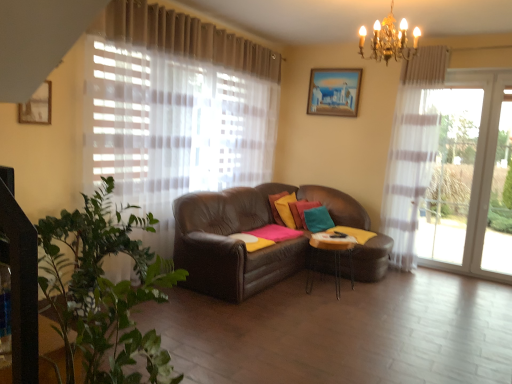
Question: Considering the relative sizes of wooden picture frame at upper left, the 2th picture frame viewed from the top, and wooden painted picture frame at upper center, which is the 2th picture frame from bottom to top, in the image provided, is wooden picture frame at upper left, the 2th picture frame viewed from the top, wider than wooden painted picture frame at upper center, which is the 2th picture frame from bottom to top,?

Choices:
 (A) yes
 (B) no

Answer: (B)

Question: Is wooden picture frame at upper left, the first picture frame viewed from the front, smaller than wooden painted picture frame at upper center, marked as the 2th picture frame in a front-to-back arrangement?

Choices:
 (A) yes
 (B) no

Answer: (A)

Question: From a real-world perspective, is wooden picture frame at upper left, which is the second picture frame from right to left, located higher than wooden painted picture frame at upper center, the 1th picture frame viewed from the back?

Choices:
 (A) yes
 (B) no

Answer: (B)

Question: Is wooden picture frame at upper left, the 2th picture frame viewed from the top, oriented away from wooden painted picture frame at upper center, marked as the 2th picture frame in a front-to-back arrangement?

Choices:
 (A) yes
 (B) no

Answer: (B)

Question: Is wooden picture frame at upper left, the 2th picture frame viewed from the top, thinner than wooden painted picture frame at upper center, the first picture frame viewed from the right?

Choices:
 (A) no
 (B) yes

Answer: (B)

Question: Considering the positions of point (289, 195) and point (313, 71), is point (289, 195) closer or farther from the camera than point (313, 71)?

Choices:
 (A) closer
 (B) farther

Answer: (A)

Question: In terms of width, does velvet yellow pillow at center, marked as the first pillow in a left-to-right arrangement, look wider or thinner when compared to wooden painted picture frame at upper center, which is the 2th picture frame from bottom to top?

Choices:
 (A) wide
 (B) thin

Answer: (A)

Question: Considering their positions, is velvet yellow pillow at center, the third pillow positioned from the right, located in front of or behind wooden painted picture frame at upper center, the 1th picture frame viewed from the back?

Choices:
 (A) behind
 (B) front

Answer: (B)

Question: From the image's perspective, is velvet yellow pillow at center, marked as the first pillow in a left-to-right arrangement, located above or below wooden painted picture frame at upper center, the 1th picture frame viewed from the back?

Choices:
 (A) above
 (B) below

Answer: (B)

Question: In terms of size, does teal fabric pillow at center, which ranks as the 1th pillow in right-to-left order, appear bigger or smaller than metallic silver table at center?

Choices:
 (A) big
 (B) small

Answer: (B)

Question: From the image's perspective, is teal fabric pillow at center, arranged as the third pillow when viewed from the left, positioned above or below metallic silver table at center?

Choices:
 (A) below
 (B) above

Answer: (B)

Question: From a real-world perspective, is teal fabric pillow at center, which ranks as the 1th pillow in right-to-left order, positioned above or below metallic silver table at center?

Choices:
 (A) below
 (B) above

Answer: (B)

Question: Considering the positions of teal fabric pillow at center, which ranks as the 1th pillow in right-to-left order, and metallic silver table at center in the image, is teal fabric pillow at center, which ranks as the 1th pillow in right-to-left order, taller or shorter than metallic silver table at center?

Choices:
 (A) tall
 (B) short

Answer: (B)

Question: Is wooden painted picture frame at upper center, the first picture frame viewed from the right, inside the boundaries of gold metallic chandelier at upper center, or outside?

Choices:
 (A) inside
 (B) outside

Answer: (B)

Question: Is point (307, 104) closer or farther from the camera than point (379, 44)?

Choices:
 (A) farther
 (B) closer

Answer: (A)